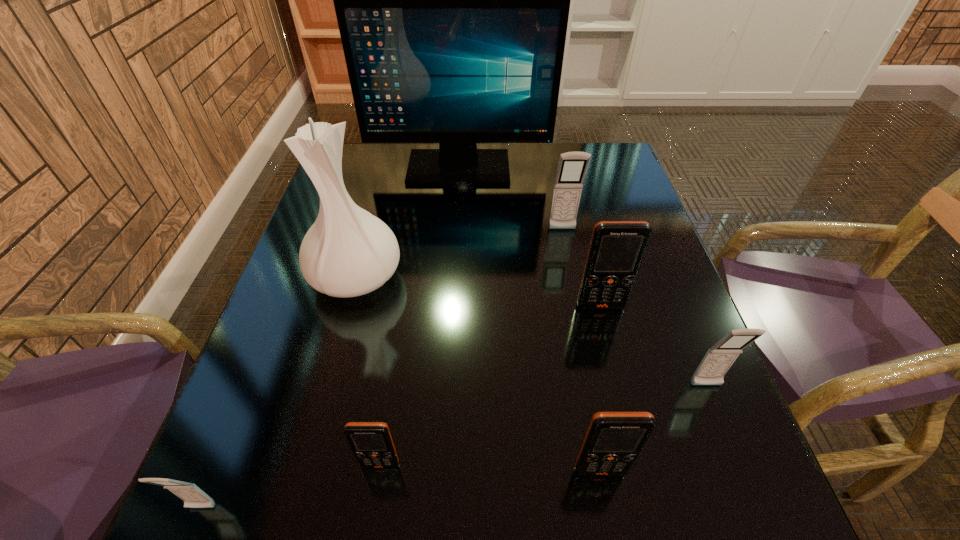
The image size is (960, 540). Identify the location of free location located 0.070m on the screen of the smallest orange cellular telephone. (372, 519).

Identify the location of object at the far edge. The image size is (960, 540). [452, 0].

Identify the location of object at the near edge. (193, 497).

This screenshot has height=540, width=960. I want to click on monitor present at the left edge, so click(x=452, y=0).

Where is `vase located in the left edge section of the desktop`? vase located in the left edge section of the desktop is located at coordinates (348, 252).

Image resolution: width=960 pixels, height=540 pixels. I want to click on cellular telephone located at the left edge, so click(193, 497).

The height and width of the screenshot is (540, 960). In order to click on object that is at the far left corner in this screenshot , I will do `click(452, 0)`.

Find the location of a particular element. This screenshot has width=960, height=540. object at the near left corner is located at coordinates pyautogui.click(x=193, y=497).

Identify the location of vacant space at the far edge of the desktop. (521, 172).

Identify the location of vacant region at the left edge of the desktop. 229,450.